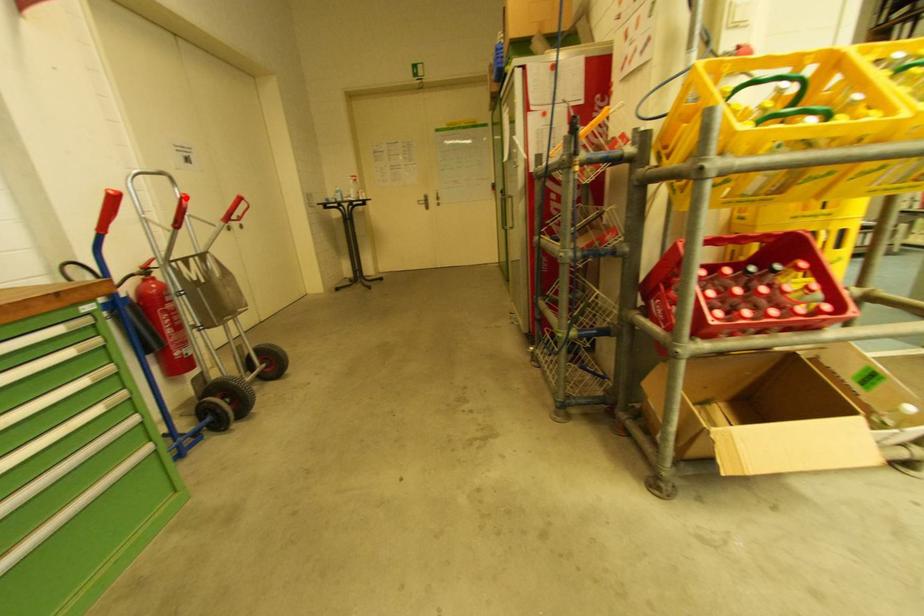
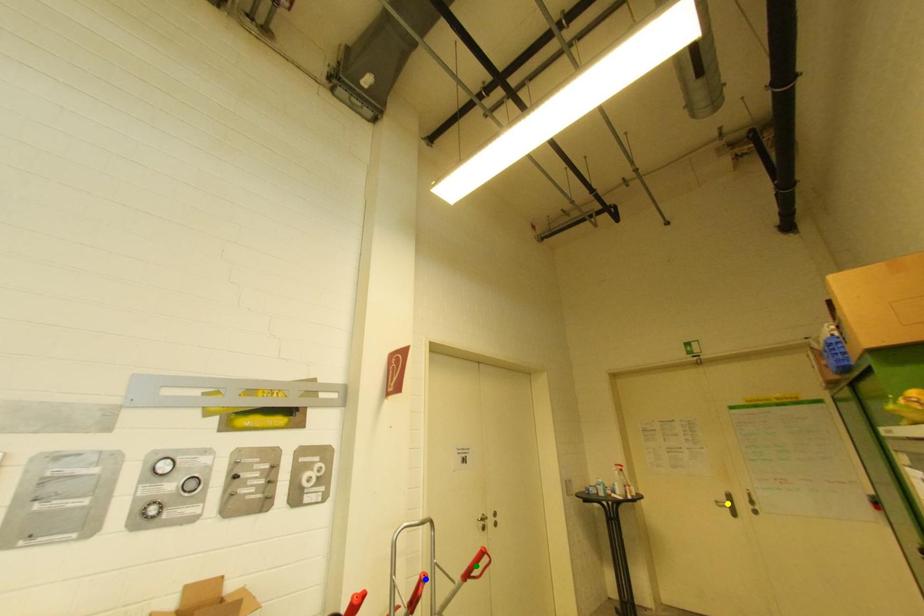
Question: I am providing you with two images of the same scene from different viewpoints. A red point is marked on the first image. You are given multiple points on the second image. Can you choose the point in image 2 that corresponds to the point in image 1?

Choices:
 (A) yellow point
 (B) green point
 (C) blue point

Answer: (C)